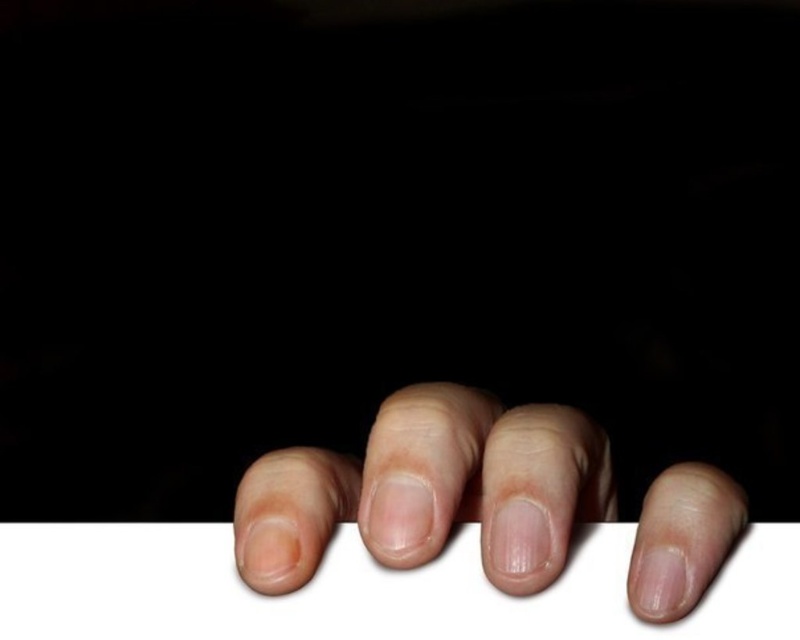
Question: Is white matte paper at bottom positioned before smooth skin hand at lower center?

Choices:
 (A) yes
 (B) no

Answer: (B)

Question: Does white matte paper at bottom appear on the left side of smooth skin hand at lower center?

Choices:
 (A) yes
 (B) no

Answer: (A)

Question: Does white matte paper at bottom lie behind smooth skin hand at lower center?

Choices:
 (A) yes
 (B) no

Answer: (A)